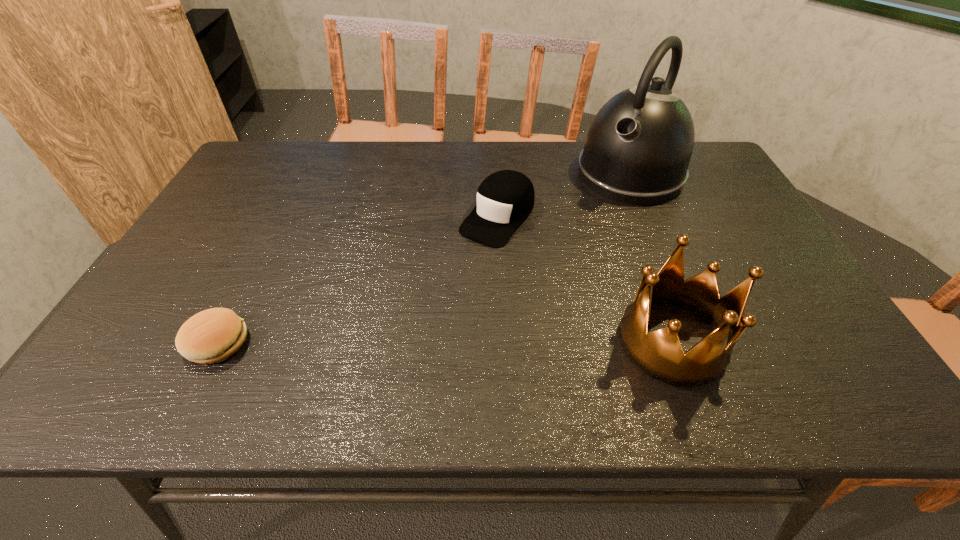
Locate an element on the screen. The width and height of the screenshot is (960, 540). object present at the far right corner is located at coordinates (638, 148).

What are the coordinates of `vacant space at the far edge` in the screenshot? It's located at (512, 144).

Where is `blank space at the near edge of the desktop`? This screenshot has width=960, height=540. blank space at the near edge of the desktop is located at coordinates (509, 344).

Where is `free point at the left edge`? free point at the left edge is located at coordinates (241, 213).

Find the location of a particular element. The width and height of the screenshot is (960, 540). vacant space at the far left corner of the desktop is located at coordinates (290, 143).

Where is `free space at the far right corner of the desktop`? free space at the far right corner of the desktop is located at coordinates (717, 163).

This screenshot has width=960, height=540. I want to click on vacant area that lies between the tallest object and the second object from left to right, so click(x=564, y=195).

Identify the location of free space between the crown and the leftmost object. The width and height of the screenshot is (960, 540). (444, 342).

I want to click on unoccupied area between the tallest object and the patty, so click(423, 259).

At what (x,y) coordinates should I click in order to perform the action: click on vacant area that lies between the second tallest object and the tallest object. Please return your answer as a coordinate pair (x, y). The height and width of the screenshot is (540, 960). Looking at the image, I should click on tap(651, 258).